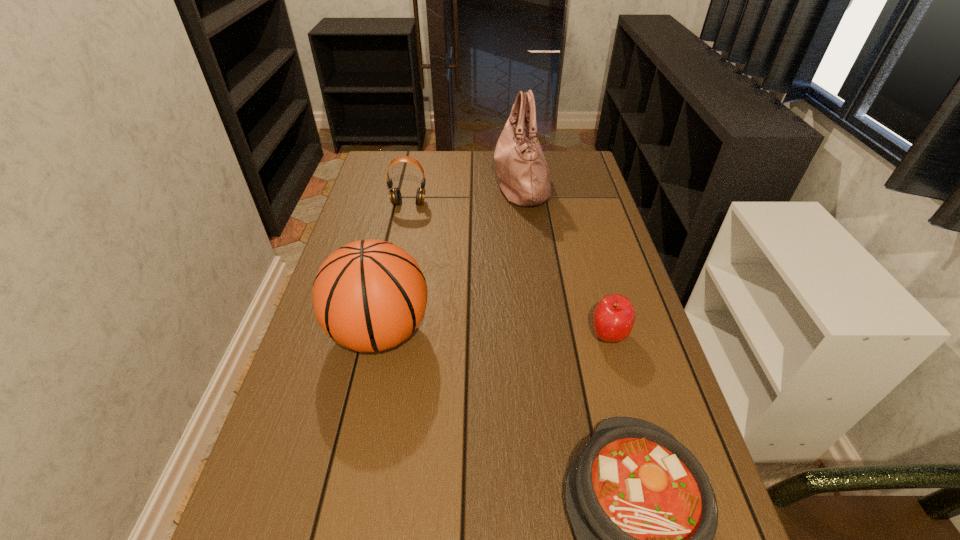
You are a GUI agent. You are given a task and a screenshot of the screen. Output one action in this format:
    pyautogui.click(x=<x>, y=<y>)
    Task: Click on the vacant point located between the handbag and the apple
    
    Given the screenshot: What is the action you would take?
    pyautogui.click(x=564, y=259)

Image resolution: width=960 pixels, height=540 pixels. Find the location of `empty space between the handbag and the apple`. empty space between the handbag and the apple is located at coordinates (564, 259).

Locate an element on the screen. free space that is in between the second tallest object and the apple is located at coordinates (494, 333).

Where is `unoccupied position between the handbag and the third shortest object`? The image size is (960, 540). unoccupied position between the handbag and the third shortest object is located at coordinates point(465,193).

This screenshot has width=960, height=540. Find the location of `object identified as the third closest to the basketball`. object identified as the third closest to the basketball is located at coordinates (395, 196).

Identify the location of object that is the second closest to the basketball. (613, 319).

I want to click on free space that satisfies the following two spatial constraints: 1. at the front of the tallest object with handles; 2. on the ear cups of the headset, so click(x=523, y=204).

I want to click on free space that satisfies the following two spatial constraints: 1. on the ear cups of the headset; 2. on the right side of the apple, so click(381, 335).

The image size is (960, 540). Identify the location of vacant position in the image that satisfies the following two spatial constraints: 1. at the front of the tallest object with handles; 2. on the front side of the basketball. (540, 332).

Where is `free location that satisfies the following two spatial constraints: 1. at the front of the tallest object with handles; 2. on the back side of the apple`? free location that satisfies the following two spatial constraints: 1. at the front of the tallest object with handles; 2. on the back side of the apple is located at coordinates (540, 335).